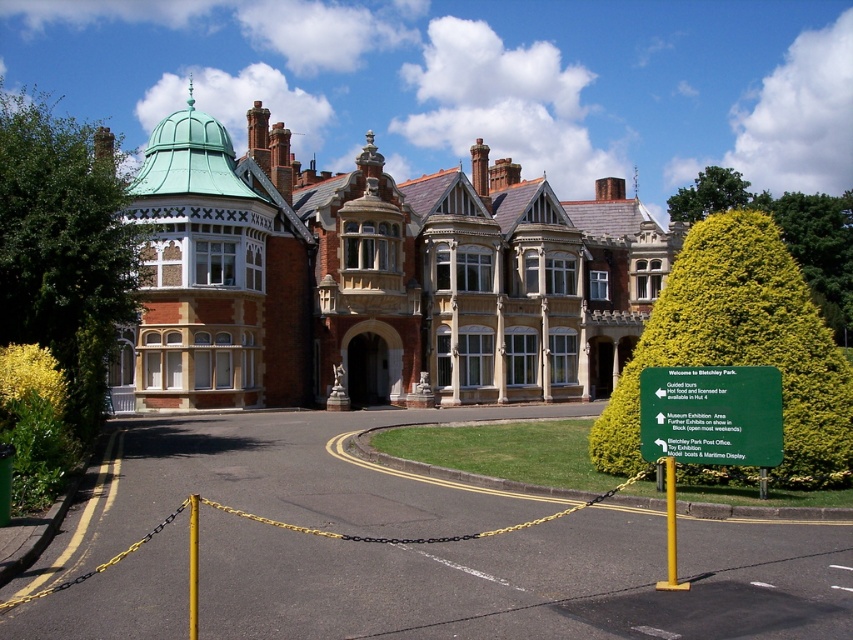
You are standing at the entrance of the brick mansion at center and want to see the yellow textured hedge at upper right. In which direction should you look relative to your position?

The brick mansion at center is above the yellow textured hedge at upper right, so you should look downward to see the yellow textured hedge at upper right.